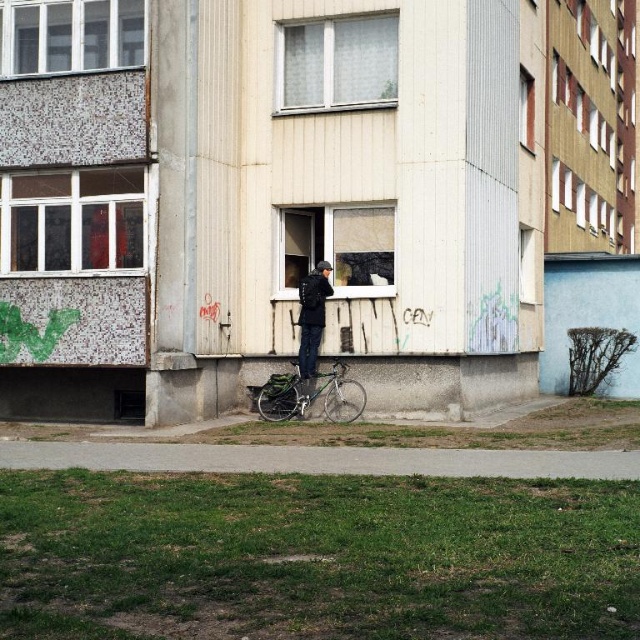
You are a delivery person trying to load a package onto your shiny metallic bicycle at center. The package requires that the bicycle must be taller than the dark blue fabric jacket at center to fit properly. Can you load the package?

The shiny metallic bicycle at center is not as tall as dark blue fabric jacket at center, so the bicycle is shorter than required. Therefore, the package cannot be loaded properly.

You are a delivery person who needs to carry both the shiny metallic bicycle at center and the dark blue fabric jacket at center in your van. Given their sizes, which item will require more space in the van?

The shiny metallic bicycle at center requires more space in the van because it has a larger size compared to the dark blue fabric jacket at center.

Consider the image. You are a delivery person who needs to park your bicycle in a secure spot near the building. The building has an open window at point (310, 396). Where should you park your bicycle so it doesn t get stolen?

The point (310, 396) corresponds to the shiny metallic bicycle at center, so you should park your bicycle near the shiny metallic bicycle at center where it is already secured.